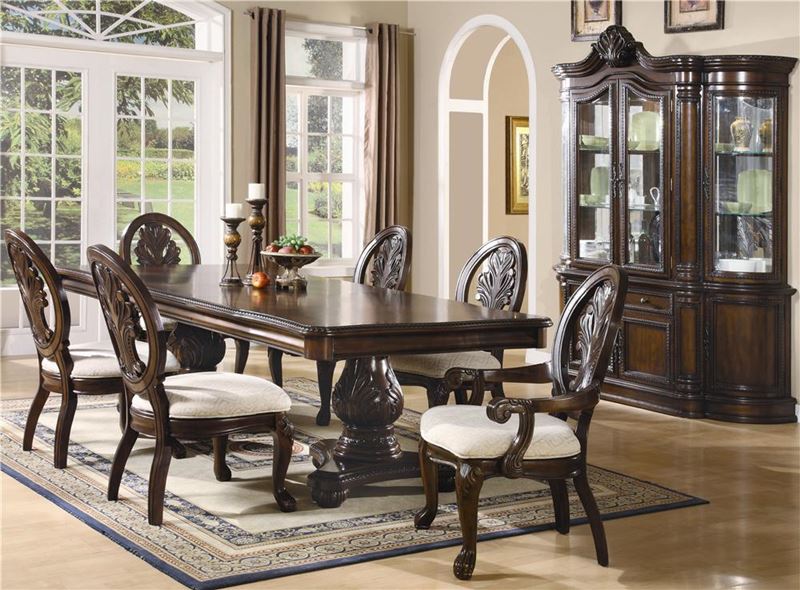
The height and width of the screenshot is (590, 800). What are the coordinates of `chairs` in the screenshot? It's located at (161, 242), (57, 295), (138, 343), (380, 268), (512, 276), (589, 333).